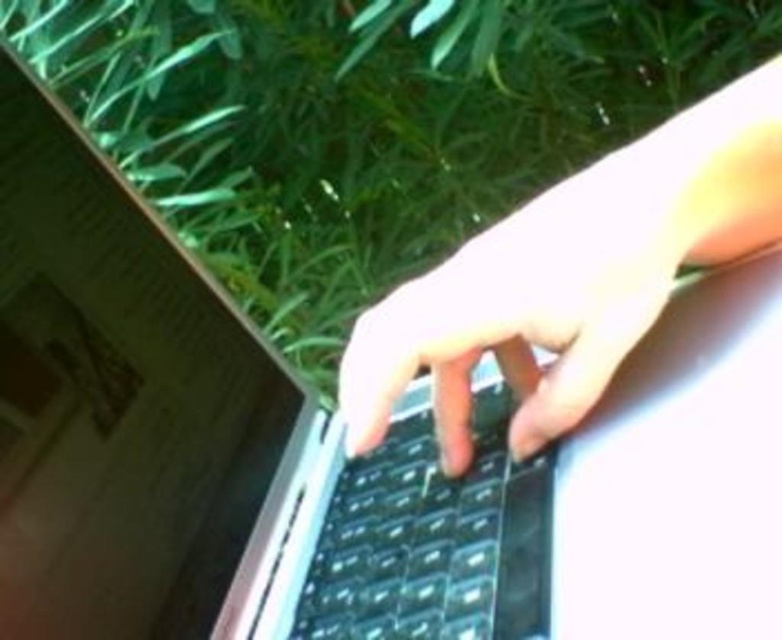
Is sleek silver laptop at center to the right of satin black hand at center from the viewer's perspective?

Incorrect, sleek silver laptop at center is not on the right side of satin black hand at center.

Based on the photo, is sleek silver laptop at center further to camera compared to satin black hand at center?

No, sleek silver laptop at center is closer to the viewer.

Measure the distance between sleek silver laptop at center and camera.

sleek silver laptop at center is 14.17 inches from camera.

The width and height of the screenshot is (782, 640). In order to click on sleek silver laptop at center in this screenshot , I will do `click(213, 445)`.

Measure the distance between satin black hand at center and camera.

The distance of satin black hand at center from camera is 15.46 inches.

Which is more to the left, satin black hand at center or black plastic keyboard at center?

Positioned to the left is black plastic keyboard at center.

Locate an element on the screen. This screenshot has width=782, height=640. satin black hand at center is located at coordinates click(x=528, y=307).

Locate an element on the screen. The width and height of the screenshot is (782, 640). satin black hand at center is located at coordinates (528, 307).

Who is more distant from viewer, [79,320] or [382,532]?

Positioned behind is point [382,532].

Does sleek silver laptop at center have a greater height compared to black plastic keyboard at center?

Indeed, sleek silver laptop at center has a greater height compared to black plastic keyboard at center.

Does point (99, 458) come behind point (414, 634)?

Yes.

Where is `sleek silver laptop at center`? Image resolution: width=782 pixels, height=640 pixels. sleek silver laptop at center is located at coordinates (213, 445).